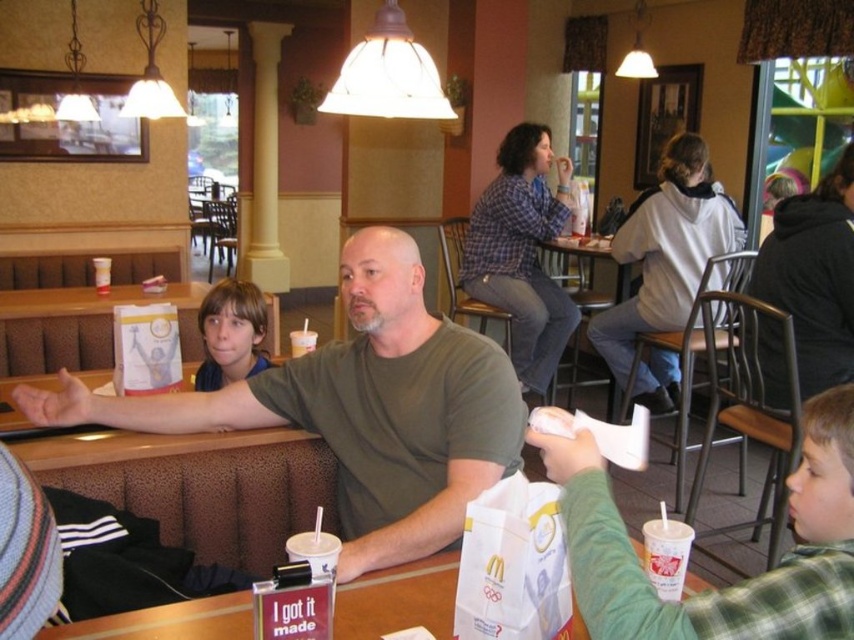
You are a photographer trying to capture a candid shot of the light brown hair at center and the wooden table at center. Which object should you focus on first if you want to ensure both are in the frame without moving the camera?

You should focus on the wooden table at center first because it occupies more space than the light brown hair at center, making it easier to frame both objects simultaneously.

You are a customer at McDonalds and you see a white paper bag at center and a light brown hair at center. Which object is smaller in size?

The white paper bag at center is smaller in size compared to the light brown hair at center.